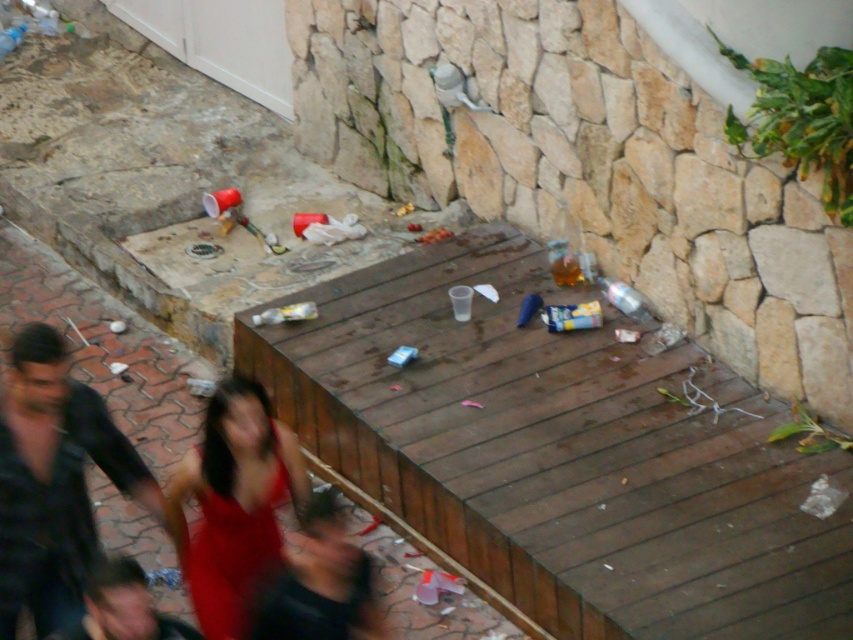
Question: Is red satin dress at lower center smaller than dark brown leather jacket at lower center?

Choices:
 (A) yes
 (B) no

Answer: (B)

Question: Based on their relative distances, which object is nearer to the red satin dress at lower center?

Choices:
 (A) dark brown leather jacket at lower center
 (B) smooth black shirt at lower left
 (C) dark blue shirt at lower left

Answer: (A)

Question: Can you confirm if red satin dress at lower center is positioned below smooth black shirt at lower left?

Choices:
 (A) yes
 (B) no

Answer: (B)

Question: Which point is farther to the camera?

Choices:
 (A) (94, 566)
 (B) (207, 531)

Answer: (A)

Question: Which point is farther from the camera taking this photo?

Choices:
 (A) (138, 586)
 (B) (236, 586)

Answer: (B)

Question: From the image, what is the correct spatial relationship of dark blue shirt at lower left in relation to smooth black shirt at lower left?

Choices:
 (A) above
 (B) below

Answer: (A)